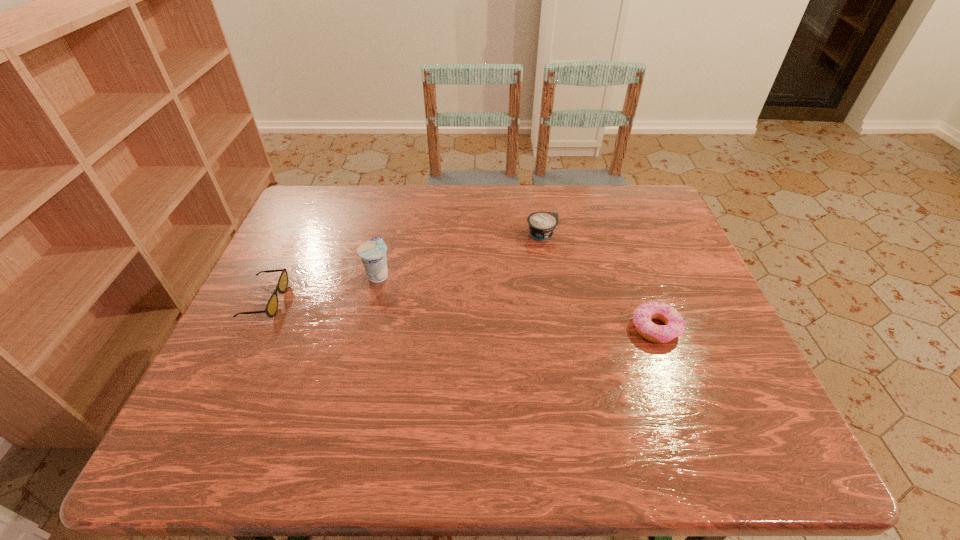
Where is `vacant space that is in between the left yogurt and the shortest object`? The image size is (960, 540). vacant space that is in between the left yogurt and the shortest object is located at coordinates (516, 301).

You are a GUI agent. You are given a task and a screenshot of the screen. Output one action in this format:
    pyautogui.click(x=<x>, y=<y>)
    Task: Click on the free area in between the sunglasses and the doughnut
    This screenshot has width=960, height=540.
    Given the screenshot: What is the action you would take?
    pyautogui.click(x=460, y=314)

Image resolution: width=960 pixels, height=540 pixels. What are the coordinates of `unoccupied area between the left yogurt and the farther yogurt` in the screenshot? It's located at (460, 254).

Where is `vacant area that lies between the right yogurt and the third object from right to left`? vacant area that lies between the right yogurt and the third object from right to left is located at coordinates (460, 254).

In order to click on vacant space that's between the tallest object and the right yogurt in this screenshot , I will do `click(460, 254)`.

You are a GUI agent. You are given a task and a screenshot of the screen. Output one action in this format:
    pyautogui.click(x=<x>, y=<y>)
    Task: Click on the empty space that is in between the leftmost object and the doughnut
    This screenshot has width=960, height=540.
    Given the screenshot: What is the action you would take?
    pyautogui.click(x=460, y=314)

At what (x,y) coordinates should I click in order to perform the action: click on free space between the doughnut and the tallest object. Please return your answer as a coordinate pair (x, y). Looking at the image, I should click on (516, 301).

You are a GUI agent. You are given a task and a screenshot of the screen. Output one action in this format:
    pyautogui.click(x=<x>, y=<y>)
    Task: Click on the free space between the rightmost object and the leftmost object
    This screenshot has height=540, width=960.
    Given the screenshot: What is the action you would take?
    pyautogui.click(x=460, y=314)

Where is `vacant area between the sunglasses and the nearer yogurt`? This screenshot has height=540, width=960. vacant area between the sunglasses and the nearer yogurt is located at coordinates (322, 288).

The width and height of the screenshot is (960, 540). I want to click on free space between the shortest object and the sunglasses, so click(x=460, y=314).